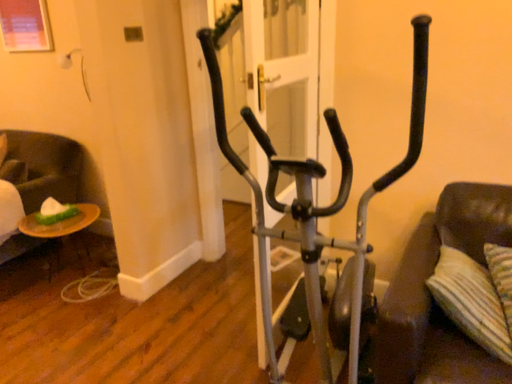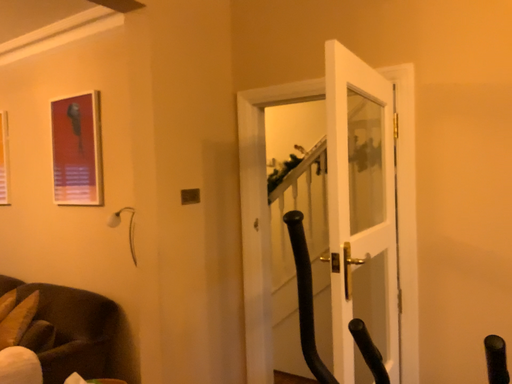
Question: How did the camera likely rotate when shooting the video?

Choices:
 (A) rotated downward
 (B) rotated upward

Answer: (B)